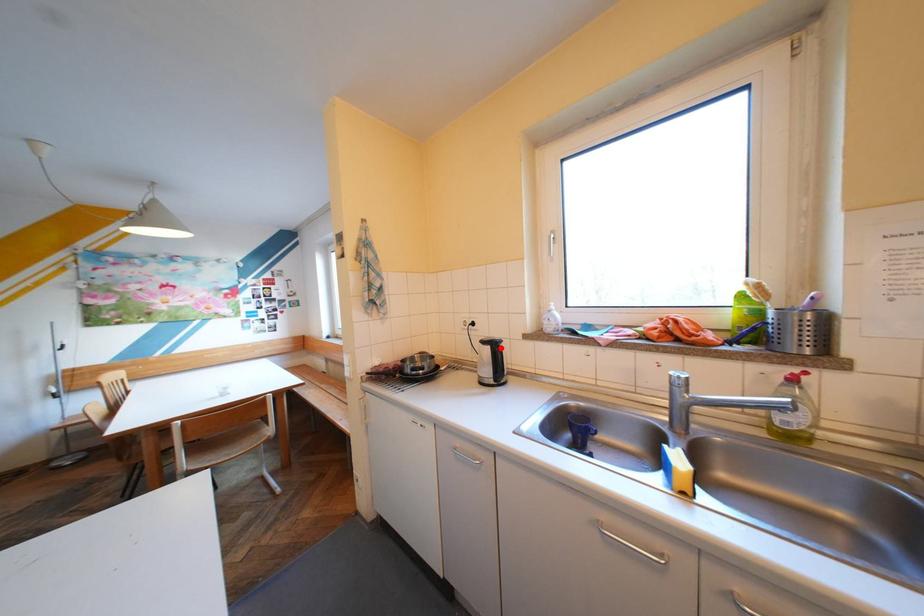
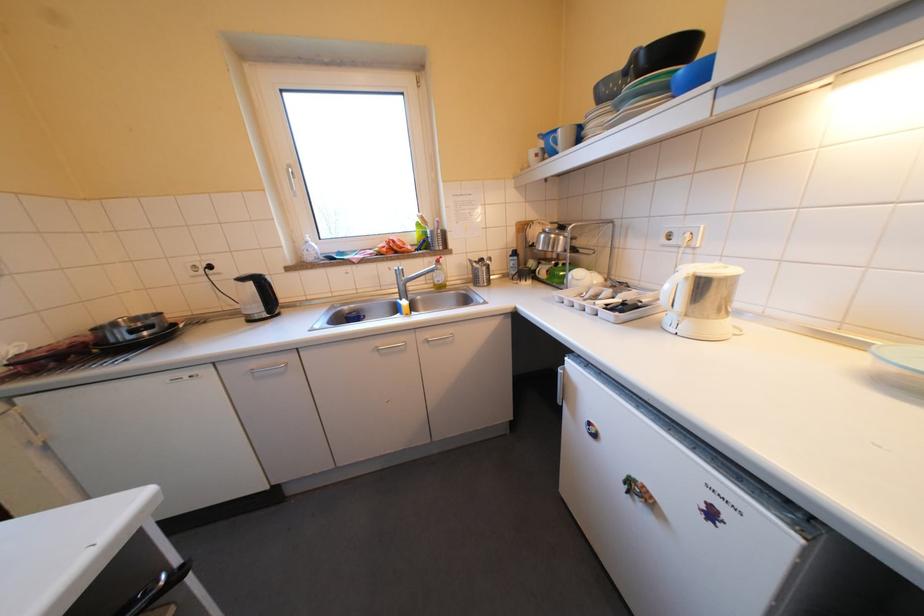
Question: I am providing you with two images of the same scene from different viewpoints. Given a red point in image1, look at the same physical point in image2. Is it:

Choices:
 (A) Closer to the viewpoint
 (B) Farther from the viewpoint

Answer: (A)